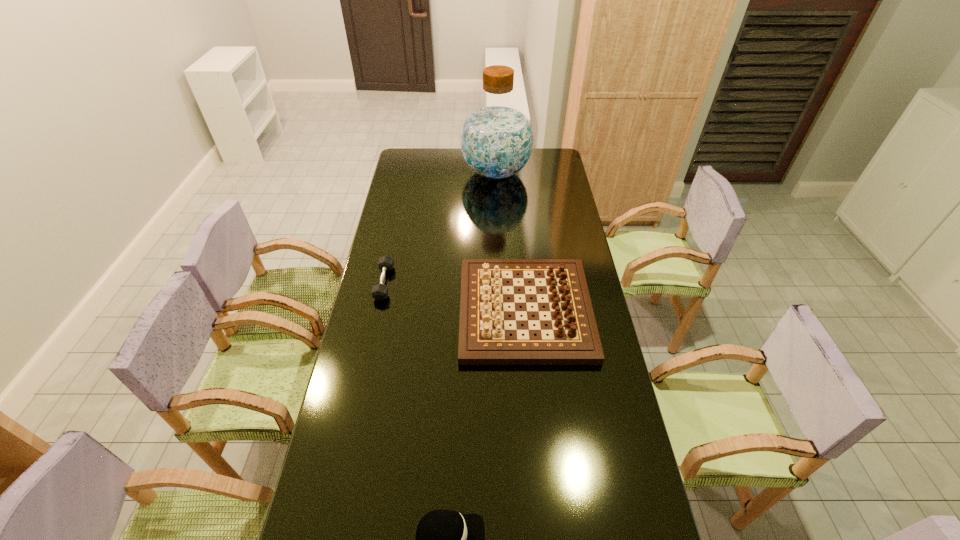
Locate an element on the screen. object present at the far edge is located at coordinates (496, 139).

Find the location of a particular element. This screenshot has height=540, width=960. object present at the left edge is located at coordinates (379, 292).

Find the location of a particular element. This screenshot has height=540, width=960. water jug positioned at the right edge is located at coordinates (496, 139).

At what (x,y) coordinates should I click in order to perform the action: click on gameboard that is at the right edge. Please return your answer as a coordinate pair (x, y). The width and height of the screenshot is (960, 540). Looking at the image, I should click on (484, 333).

What are the coordinates of `object present at the far right corner` in the screenshot? It's located at (496, 139).

What are the coordinates of `vacant position at the left edge of the desktop` in the screenshot? It's located at click(x=324, y=492).

Where is `vacant region at the right edge`? This screenshot has width=960, height=540. vacant region at the right edge is located at coordinates (585, 262).

Identify the location of vacant area at the far right corner of the desktop. [557, 153].

Where is `vacant space in between the gameboard and the dumbbell`? Image resolution: width=960 pixels, height=540 pixels. vacant space in between the gameboard and the dumbbell is located at coordinates (455, 296).

This screenshot has width=960, height=540. Find the location of `vacant space in between the third shortest object and the water jug`. vacant space in between the third shortest object and the water jug is located at coordinates (511, 241).